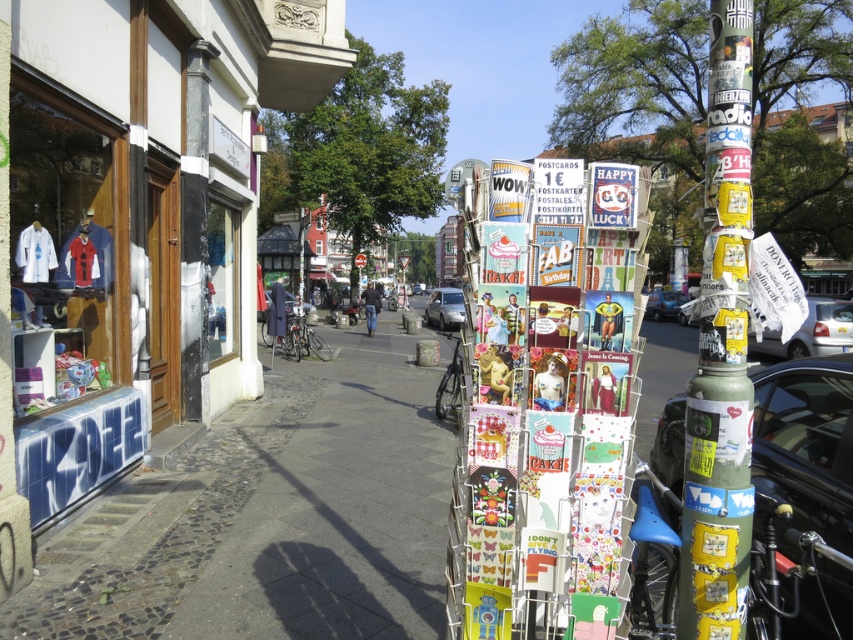
Can you confirm if cobblestone pavement at lower left is smaller than metallic green car at right?

Actually, cobblestone pavement at lower left might be larger than metallic green car at right.

Which is more to the left, cobblestone pavement at lower left or metallic green car at right?

cobblestone pavement at lower left

Identify the location of cobblestone pavement at lower left. pyautogui.click(x=274, y=516).

Find the location of a particular element. The width and height of the screenshot is (853, 640). cobblestone pavement at lower left is located at coordinates (274, 516).

Can you confirm if cobblestone pavement at lower left is positioned above silver metallic car at center?

No, cobblestone pavement at lower left is not above silver metallic car at center.

Which is above, cobblestone pavement at lower left or silver metallic car at center?

silver metallic car at center

Does point (344, 532) come closer to viewer compared to point (450, 312)?

That is True.

Locate an element on the screen. The image size is (853, 640). cobblestone pavement at lower left is located at coordinates (274, 516).

This screenshot has width=853, height=640. Describe the element at coordinates (720, 353) in the screenshot. I see `green textured pole at right` at that location.

Does green textured pole at right appear under white glossy car at right?

No, green textured pole at right is not below white glossy car at right.

The width and height of the screenshot is (853, 640). What do you see at coordinates (720, 353) in the screenshot? I see `green textured pole at right` at bounding box center [720, 353].

Identify the location of green textured pole at right. (720, 353).